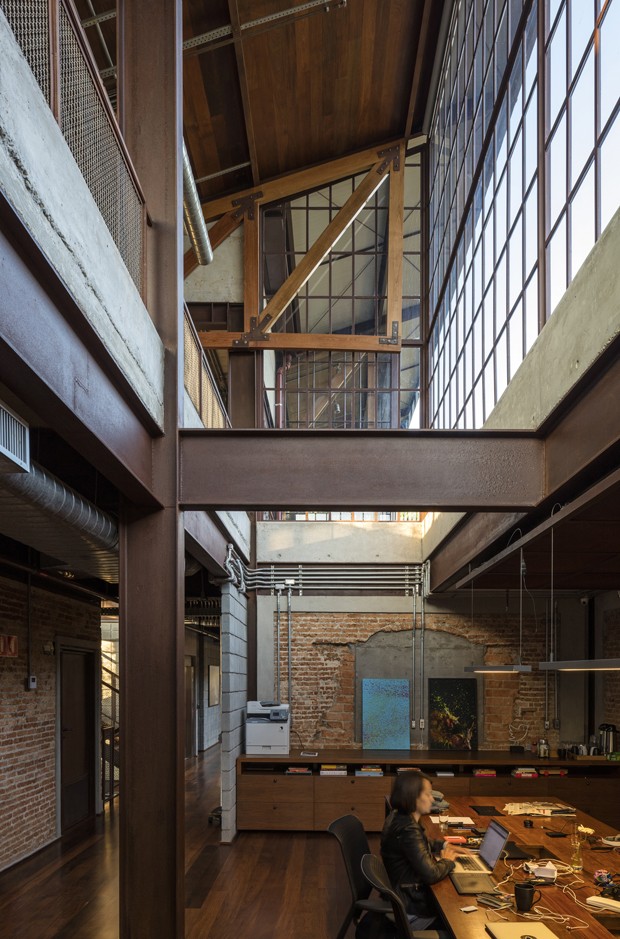
Locate an element on the screen. This screenshot has width=620, height=939. table is located at coordinates (488, 844).